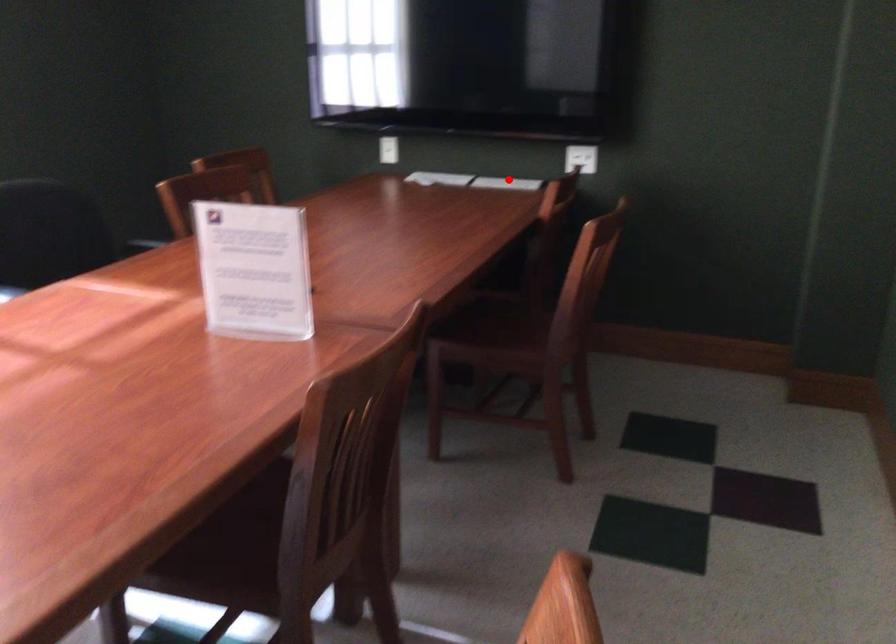
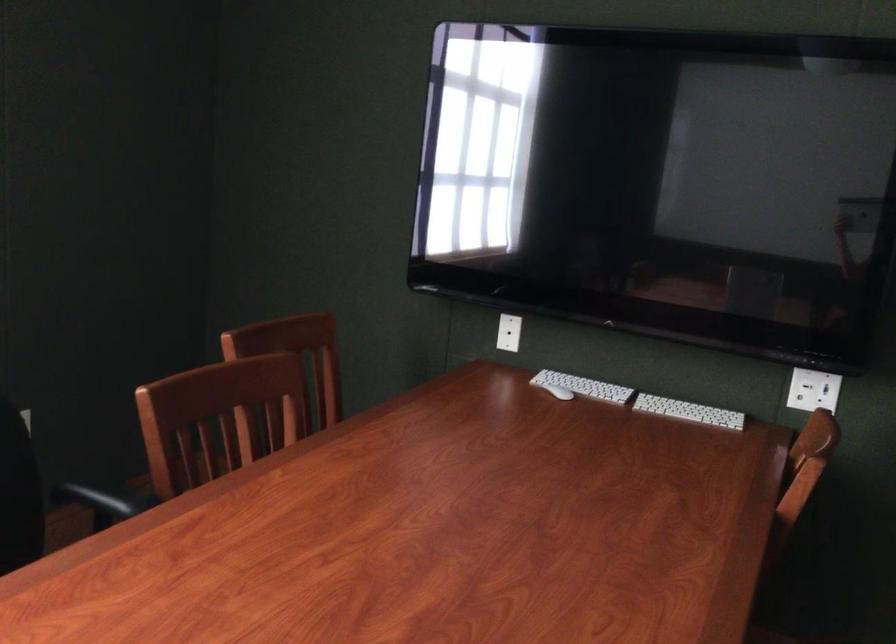
The point at the highlighted location is marked in the first image. Where is the corresponding point in the second image?

(688, 412)